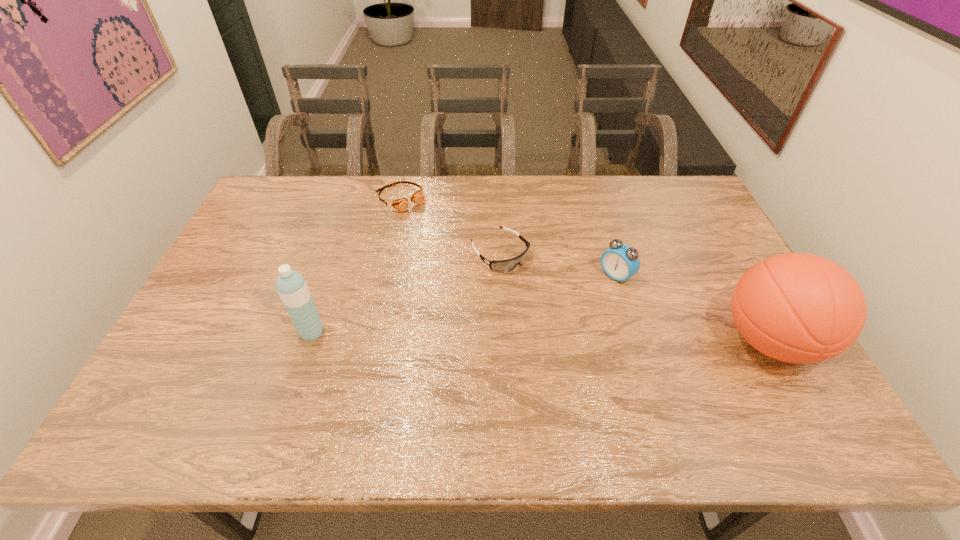
You are a GUI agent. You are given a task and a screenshot of the screen. Output one action in this format:
    pyautogui.click(x=<x>, y=<y>)
    Task: Click on the object located at the near edge
    
    Given the screenshot: What is the action you would take?
    pyautogui.click(x=802, y=308)

Find the location of a particular element. object that is positioned at the right edge is located at coordinates (802, 308).

In order to click on object located at the near right corner in this screenshot , I will do `click(802, 308)`.

Locate an element on the screen. free space at the far edge is located at coordinates (469, 176).

Image resolution: width=960 pixels, height=540 pixels. In the image, there is a desktop. Identify the location of free space at the near edge. (279, 380).

The height and width of the screenshot is (540, 960). Identify the location of free space at the left edge of the desktop. (229, 272).

Find the location of a particular element. Image resolution: width=960 pixels, height=540 pixels. vacant area at the right edge of the desktop is located at coordinates (726, 266).

In the image, there is a desktop. Where is `vacant space at the near left corner`? The height and width of the screenshot is (540, 960). vacant space at the near left corner is located at coordinates (184, 379).

Identify the location of vacant point located between the third object from left to right and the leftmost object. This screenshot has height=540, width=960. (406, 293).

Image resolution: width=960 pixels, height=540 pixels. Find the location of `free area in between the basketball and the leftmost object`. free area in between the basketball and the leftmost object is located at coordinates (540, 336).